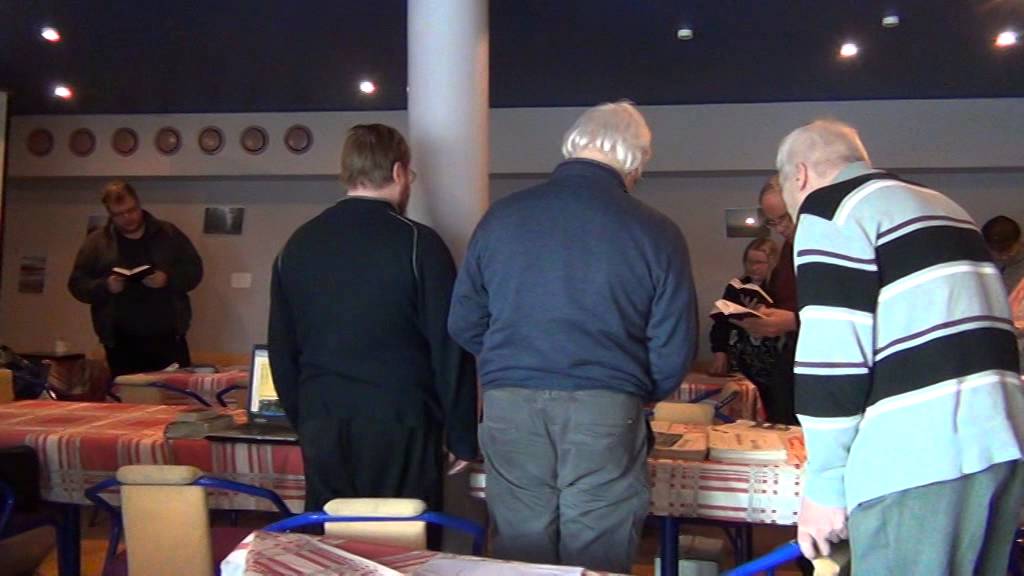
This screenshot has width=1024, height=576. I want to click on tables, so (x=106, y=434), (x=706, y=483), (x=692, y=385), (x=209, y=382), (x=336, y=568).